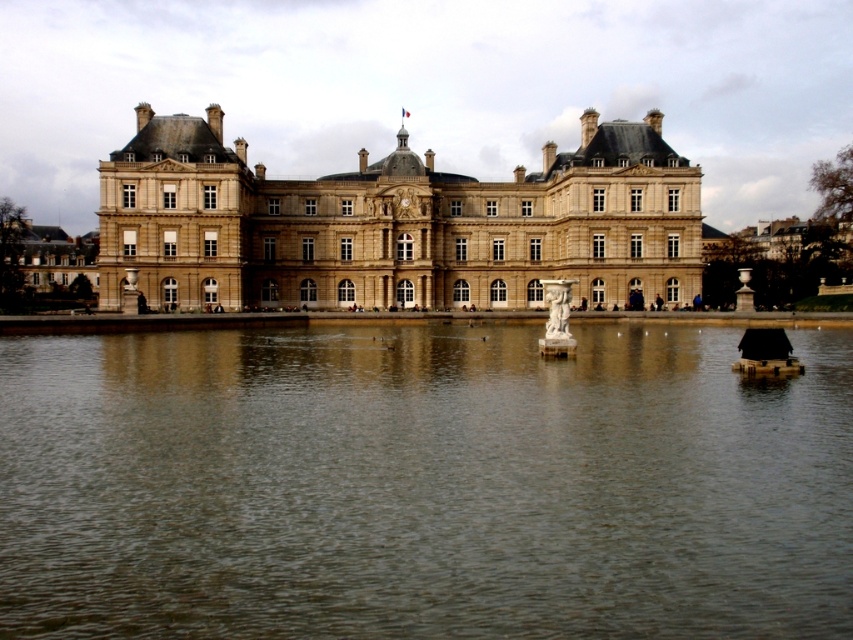
Question: Does brown reflective water at center have a lesser width compared to white marble statue at center?

Choices:
 (A) yes
 (B) no

Answer: (B)

Question: Which of these objects is positioned farthest from the white marble statue at center?

Choices:
 (A) brown reflective water at center
 (B) brown stone building at center

Answer: (A)

Question: Does brown stone building at center have a lesser width compared to white marble statue at center?

Choices:
 (A) yes
 (B) no

Answer: (B)

Question: Which of the following is the farthest from the observer?

Choices:
 (A) brown reflective water at center
 (B) brown stone building at center
 (C) white marble statue at center

Answer: (B)

Question: Is brown reflective water at center below white marble statue at center?

Choices:
 (A) yes
 (B) no

Answer: (A)

Question: Which point is farther to the camera?

Choices:
 (A) (547, 332)
 (B) (213, 269)
 (C) (550, 401)

Answer: (B)